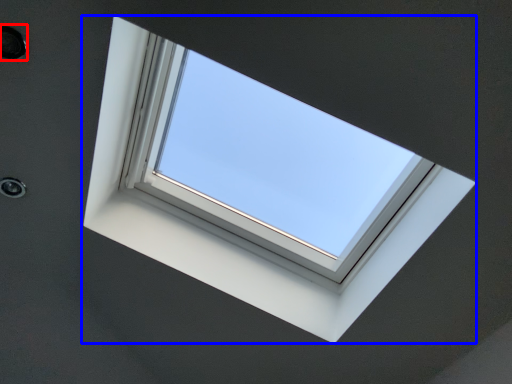
Question: Which object appears closest to the camera in this image, hole (highlighted by a red box) or window (highlighted by a blue box)?

Choices:
 (A) hole
 (B) window

Answer: (B)